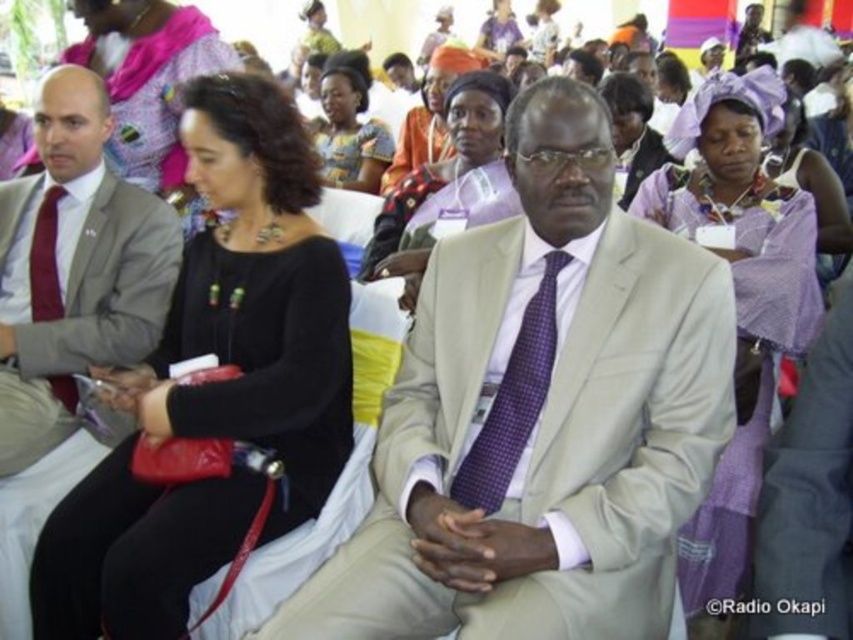
Is purple checkered tie at center behind matte red tie at left?

No.

Does purple checkered tie at center have a larger size compared to matte red tie at left?

Yes.

Between point (480, 436) and point (45, 192), which one is positioned in front?

Positioned in front is point (480, 436).

Locate an element on the screen. The width and height of the screenshot is (853, 640). purple checkered tie at center is located at coordinates (x=514, y=401).

Who is shorter, purple woven fabric headscarf at upper center or matte purple dress at center?

Standing shorter between the two is purple woven fabric headscarf at upper center.

Which is more to the left, purple woven fabric headscarf at upper center or matte purple dress at center?

matte purple dress at center is more to the left.

Which is behind, point (723, 509) or point (329, 77)?

The point (329, 77) is behind.

What are the coordinates of `purple woven fabric headscarf at upper center` in the screenshot? It's located at (737, 292).

Looking at this image, who is taller, purple woven fabric headscarf at upper center or matte red tie at left?

matte red tie at left is taller.

Is purple woven fabric headscarf at upper center further to camera compared to matte red tie at left?

That is False.

Does point (724, 540) come farther from viewer compared to point (36, 269)?

No.

Find the location of `purple woven fabric headscarf at upper center`. purple woven fabric headscarf at upper center is located at coordinates (737, 292).